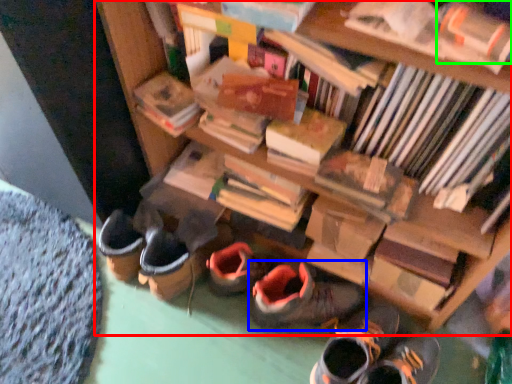
Question: Estimate the real-world distances between objects in this image. Which object is closer to bookcase (highlighted by a red box), footwear (highlighted by a blue box) or book (highlighted by a green box)?

Choices:
 (A) footwear
 (B) book

Answer: (A)